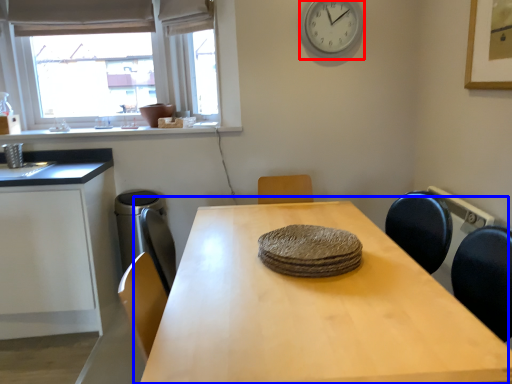
Question: Which object appears farthest to the camera in this image, clock (highlighted by a red box) or table (highlighted by a blue box)?

Choices:
 (A) clock
 (B) table

Answer: (A)